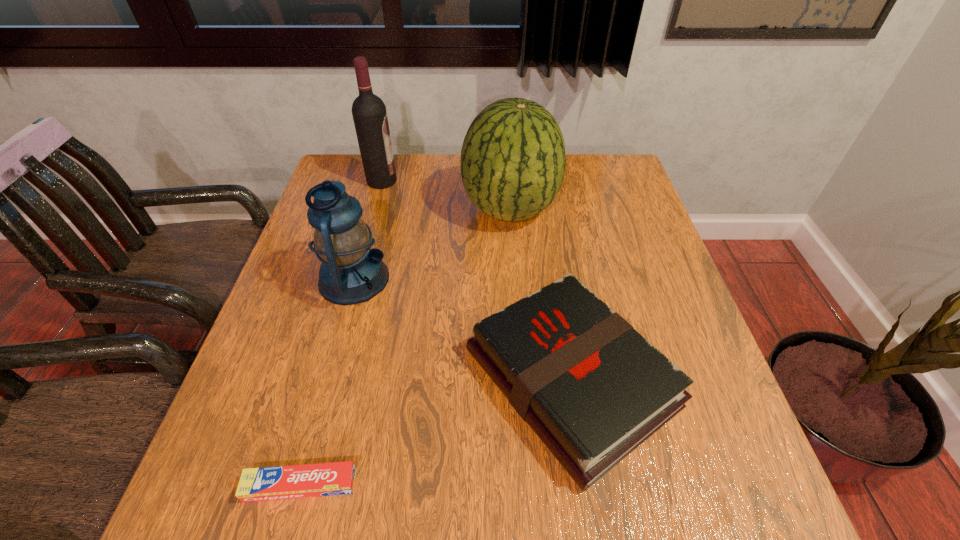
Where is `free point that satisfies the following two spatial constraints: 1. on the face of the toothpaste; 2. on the right side of the lantern`? free point that satisfies the following two spatial constraints: 1. on the face of the toothpaste; 2. on the right side of the lantern is located at coordinates (298, 485).

Find the location of a particular element. vacant space that satisfies the following two spatial constraints: 1. on the label of the wine bottle; 2. on the right side of the watermelon is located at coordinates (374, 210).

At what (x,y) coordinates should I click in order to perform the action: click on vacant region that satisfies the following two spatial constraints: 1. on the face of the lantern; 2. on the right side of the hardback book. Please return your answer as a coordinate pair (x, y). Looking at the image, I should click on (326, 379).

Image resolution: width=960 pixels, height=540 pixels. Find the location of `free space that satisfies the following two spatial constraints: 1. on the back side of the hardback book; 2. on the face of the lantern`. free space that satisfies the following two spatial constraints: 1. on the back side of the hardback book; 2. on the face of the lantern is located at coordinates [x=554, y=279].

In order to click on free space that satisfies the following two spatial constraints: 1. on the face of the lantern; 2. on the left side of the hardback book in this screenshot , I will do [x=326, y=379].